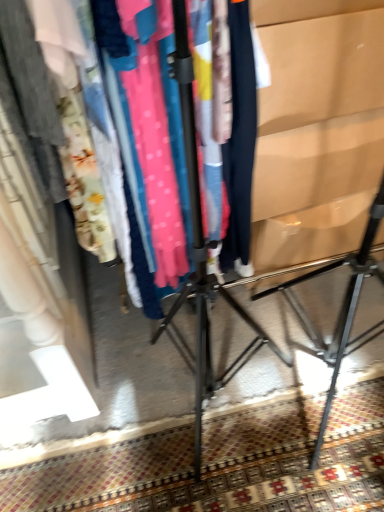
Question: Can you confirm if matte black clothing rack at center is taller than carpeted floor at lower center?

Choices:
 (A) no
 (B) yes

Answer: (B)

Question: From the image's perspective, is matte black clothing rack at center on top of carpeted floor at lower center?

Choices:
 (A) no
 (B) yes

Answer: (B)

Question: Does matte black clothing rack at center lie in front of carpeted floor at lower center?

Choices:
 (A) no
 (B) yes

Answer: (B)

Question: Is the surface of matte black clothing rack at center in direct contact with carpeted floor at lower center?

Choices:
 (A) no
 (B) yes

Answer: (A)

Question: Can you confirm if matte black clothing rack at center is shorter than carpeted floor at lower center?

Choices:
 (A) no
 (B) yes

Answer: (A)

Question: Is the depth of matte black clothing rack at center greater than that of carpeted floor at lower center?

Choices:
 (A) no
 (B) yes

Answer: (A)

Question: Is carpeted floor at lower center not inside matte cardboard at right?

Choices:
 (A) yes
 (B) no

Answer: (A)

Question: Considering the relative positions of carpeted floor at lower center and matte cardboard at right in the image provided, is carpeted floor at lower center to the right of matte cardboard at right from the viewer's perspective?

Choices:
 (A) yes
 (B) no

Answer: (B)

Question: From the image's perspective, is carpeted floor at lower center under matte cardboard at right?

Choices:
 (A) yes
 (B) no

Answer: (A)

Question: Is carpeted floor at lower center wider than matte cardboard at right?

Choices:
 (A) yes
 (B) no

Answer: (A)

Question: Is matte cardboard at right surrounded by carpeted floor at lower center?

Choices:
 (A) yes
 (B) no

Answer: (B)

Question: Is carpeted floor at lower center oriented away from matte cardboard at right?

Choices:
 (A) yes
 (B) no

Answer: (B)

Question: From the image's perspective, is matte cardboard at right on top of carpeted floor at lower center?

Choices:
 (A) no
 (B) yes

Answer: (B)